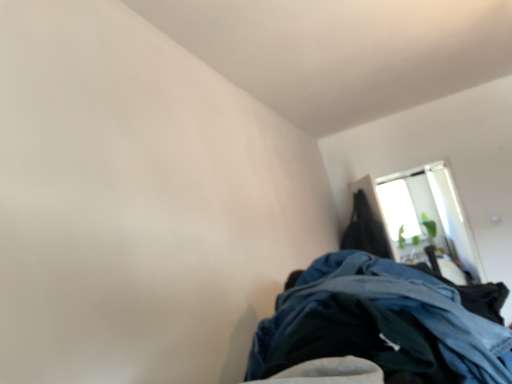
The image size is (512, 384). What do you see at coordinates (365, 230) in the screenshot?
I see `black matte coat at upper right` at bounding box center [365, 230].

This screenshot has height=384, width=512. Find the location of `black matte coat at upper right`. black matte coat at upper right is located at coordinates (365, 230).

What do you see at coordinates (429, 212) in the screenshot?
I see `transparent glass window at upper right` at bounding box center [429, 212].

Measure the distance between point [386,185] and camera.

Point [386,185] and camera are 5.55 meters apart from each other.

The width and height of the screenshot is (512, 384). I want to click on transparent glass window at upper right, so click(429, 212).

Image resolution: width=512 pixels, height=384 pixels. I want to click on black matte coat at upper right, so click(x=365, y=230).

Based on the photo, is black matte coat at upper right at the left side of transparent glass window at upper right?

Correct, you'll find black matte coat at upper right to the left of transparent glass window at upper right.

Does black matte coat at upper right come in front of transparent glass window at upper right?

Yes, black matte coat at upper right is closer to the viewer.

Which is farther from the camera, (366, 234) or (390, 177)?

The point (390, 177) is farther.

From the image's perspective, which one is positioned lower, black matte coat at upper right or transparent glass window at upper right?

From the image's view, transparent glass window at upper right is below.

From a real-world perspective, is black matte coat at upper right physically located above or below transparent glass window at upper right?

Clearly, from a real-world perspective, black matte coat at upper right is above transparent glass window at upper right.

Can you confirm if black matte coat at upper right is thinner than transparent glass window at upper right?

No.

Is black matte coat at upper right shorter than transparent glass window at upper right?

Correct, black matte coat at upper right is not as tall as transparent glass window at upper right.

Which of these two, black matte coat at upper right or transparent glass window at upper right, is smaller?

black matte coat at upper right is smaller.

Is transparent glass window at upper right inside black matte coat at upper right?

Actually, transparent glass window at upper right is outside black matte coat at upper right.

Would you say black matte coat at upper right is a long distance from transparent glass window at upper right?

Indeed, black matte coat at upper right is not near transparent glass window at upper right.

Looking at this image, does black matte coat at upper right turn towards transparent glass window at upper right?

No, black matte coat at upper right is not oriented towards transparent glass window at upper right.

How many degrees apart are the facing directions of black matte coat at upper right and transparent glass window at upper right?

The angle between the facing direction of black matte coat at upper right and the facing direction of transparent glass window at upper right is 9.39 degrees.

In the image, there is a transparent glass window at upper right. Where is `cloak above it (from the image's perspective)`? This screenshot has width=512, height=384. cloak above it (from the image's perspective) is located at coordinates (365, 230).

Based on their positions, is transparent glass window at upper right located to the left or right of black matte coat at upper right?

transparent glass window at upper right is positioned on black matte coat at upper right's right side.

Which object is further away from the camera, transparent glass window at upper right or black matte coat at upper right?

transparent glass window at upper right is further away from the camera.

Which is less distant, (381, 207) or (372, 234)?

Point (381, 207).

From the image's perspective, does transparent glass window at upper right appear higher than black matte coat at upper right?

No, from the image's perspective, transparent glass window at upper right is not over black matte coat at upper right.

From a real-world perspective, is transparent glass window at upper right physically below black matte coat at upper right?

Indeed, from a real-world perspective, transparent glass window at upper right is positioned beneath black matte coat at upper right.

Looking at their sizes, would you say transparent glass window at upper right is wider or thinner than black matte coat at upper right?

Considering their sizes, transparent glass window at upper right looks slimmer than black matte coat at upper right.

Considering the sizes of objects transparent glass window at upper right and black matte coat at upper right in the image provided, who is taller, transparent glass window at upper right or black matte coat at upper right?

Standing taller between the two is transparent glass window at upper right.

Can you confirm if transparent glass window at upper right is bigger than black matte coat at upper right?

Yes, transparent glass window at upper right is bigger than black matte coat at upper right.

Is transparent glass window at upper right not inside black matte coat at upper right?

transparent glass window at upper right lies outside black matte coat at upper right's area.

Is the surface of transparent glass window at upper right in direct contact with black matte coat at upper right?

No.

Is transparent glass window at upper right oriented towards black matte coat at upper right?

Yes, transparent glass window at upper right is turned towards black matte coat at upper right.

Can you tell me how much transparent glass window at upper right and black matte coat at upper right differ in facing direction?

They differ by 9.39 degrees in their facing directions.

How far apart are transparent glass window at upper right and black matte coat at upper right?

transparent glass window at upper right and black matte coat at upper right are 1.18 meters apart.

Locate an element on the screen. The width and height of the screenshot is (512, 384). cloak located above the transparent glass window at upper right (from a real-world perspective) is located at coordinates (365, 230).

You are a GUI agent. You are given a task and a screenshot of the screen. Output one action in this format:
    pyautogui.click(x=<x>, y=<y>)
    Task: Click on the cloak that is above the transparent glass window at upper right (from the image's perspective)
    The image size is (512, 384).
    Given the screenshot: What is the action you would take?
    pyautogui.click(x=365, y=230)

Identify the location of window that is on the right side of black matte coat at upper right. This screenshot has height=384, width=512. (429, 212).